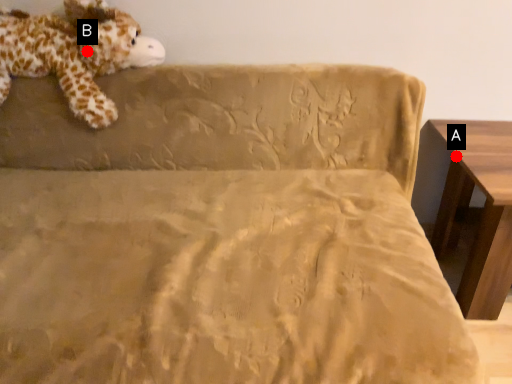
Question: Two points are circled on the image, labeled by A and B beside each circle. Which point is farther from the camera taking this photo?

Choices:
 (A) A is further
 (B) B is further

Answer: (A)